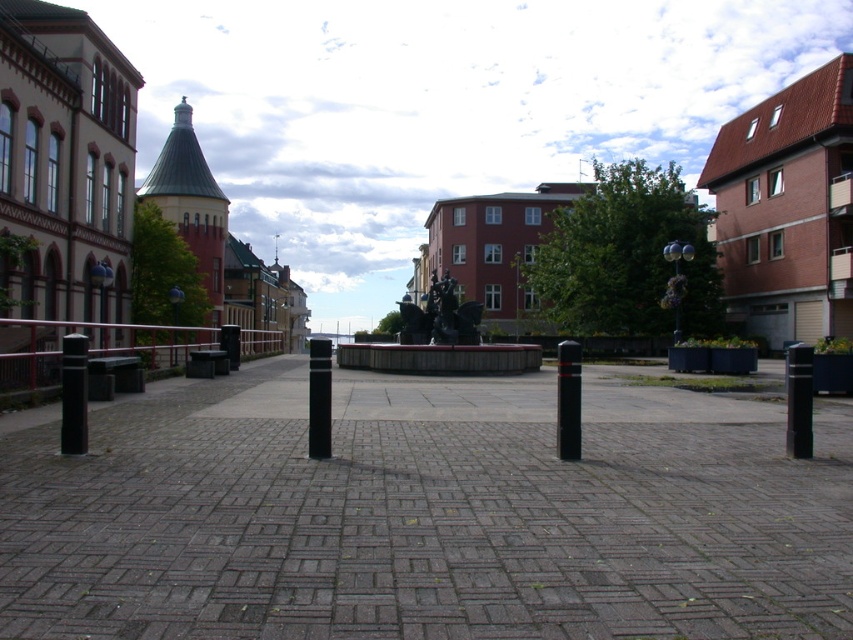
You are a city planner reviewing the layout of the square. You need to ensure that the red painted metal rail at left and the black matte pole at right are appropriately sized for their functions. Which object is bigger in size?

The red painted metal rail at left has a larger size compared to the black matte pole at right.

You are a delivery person trying to navigate through the square. You need to pass between the red painted metal rail at left and the black matte pole at right. Which direction should you move to go from the rail to the pole?

To move from the red painted metal rail at left to the black matte pole at right, you should move to the right since the red painted metal rail at left is positioned to the left of the black matte pole at right.

You are a delivery person trying to navigate through the square. You need to place a package on the ground near the red painted metal rail at left and the black polished pole at center. Which object should you place the package closer to if you want it to be more visible to people passing by?

The red painted metal rail at left is taller than the black polished pole at center, so placing the package near the red painted metal rail at left would make it more visible since taller objects can act as better landmarks.